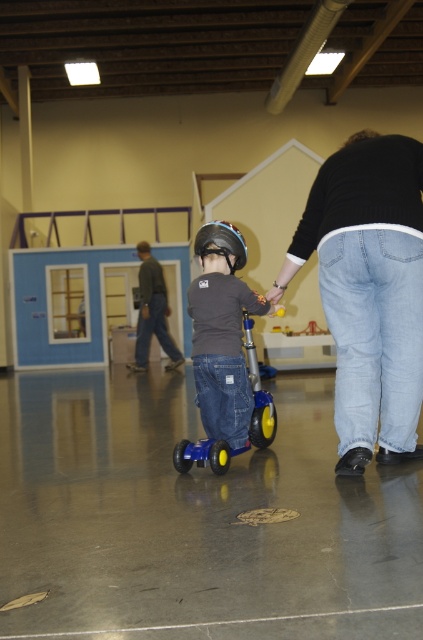
Question: Which point is farther to the camera?

Choices:
 (A) dark gray helmet at center
 (B) matte black helmet at center
 (C) jeans at center

Answer: (A)

Question: Which object appears closest to the camera in this image?

Choices:
 (A) matte black helmet at center
 (B) jeans at center
 (C) dark gray helmet at center
 (D) black matte helmet at center

Answer: (B)

Question: Is jeans at center wider than dark gray helmet at center?

Choices:
 (A) no
 (B) yes

Answer: (A)

Question: Which point appears closest to the camera in this image?

Choices:
 (A) (419, 227)
 (B) (162, 348)

Answer: (A)

Question: Can you confirm if matte black helmet at center is positioned above black matte helmet at center?

Choices:
 (A) yes
 (B) no

Answer: (B)

Question: Does dark gray helmet at center have a smaller size compared to black matte helmet at center?

Choices:
 (A) yes
 (B) no

Answer: (B)